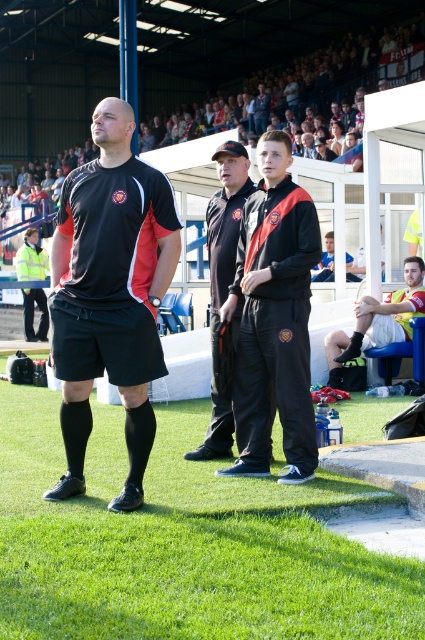
Based on the photo, you are a photographer trying to capture a closeup of the black matte shorts at center and the green grass at lower left in the image. Since you can only focus on one object at a time, which object should you choose to ensure the other is still somewhat in focus given their size difference?

The green grass at lower left has a smaller size compared to black matte shorts at center. To ensure the other object is somewhat in focus, you should focus on the black matte shorts at center because it is larger and closer to the camera, making it easier to keep the smaller green grass at lower left within the depth of field.

You are a photographer at the sports event. You need to capture a clear photo of both the black matte tracksuit at center and the blue fabric shirt at center. Which one will appear bigger in the photo?

The black matte tracksuit at center will appear bigger in the photo because it is larger in size than the blue fabric shirt at center.